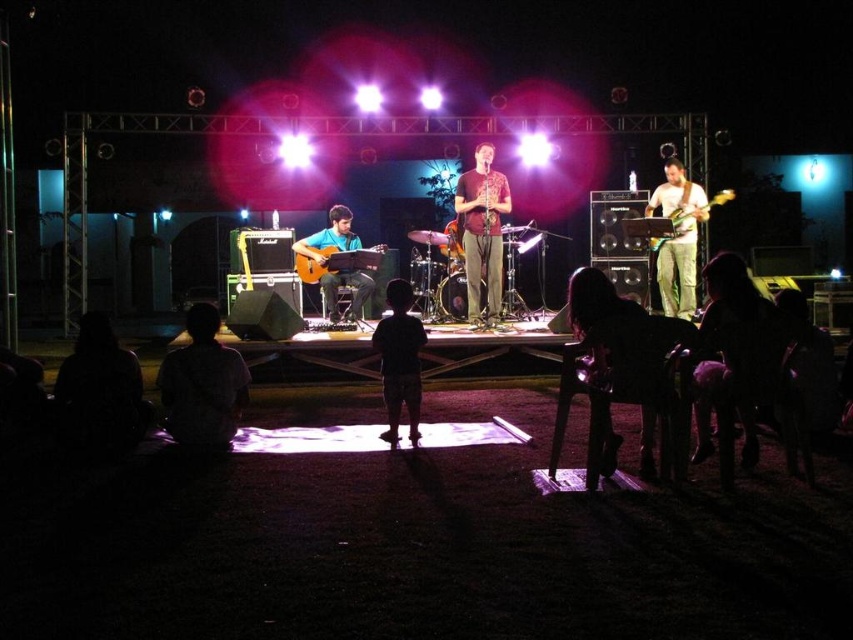
Is point (665, 300) positioned after point (682, 220)?

Yes, point (665, 300) is farther from viewer.

Is point (676, 301) closer to viewer compared to point (663, 240)?

No, (676, 301) is behind (663, 240).

Where is `green camouflage pants at right`? This screenshot has width=853, height=640. green camouflage pants at right is located at coordinates (677, 237).

Does silhouette fabric at lower left appear under dark matte shirt at center?

→ Yes, silhouette fabric at lower left is below dark matte shirt at center.

In the scene shown: Can you confirm if silhouette fabric at lower left is taller than dark matte shirt at center?

No, silhouette fabric at lower left is not taller than dark matte shirt at center.

Is point (235, 362) positioned in front of point (415, 381)?

Yes, it is.

The image size is (853, 640). I want to click on silhouette fabric at lower left, so click(x=202, y=385).

Which is more to the left, green camouflage pants at right or dark matte shirt at center?

dark matte shirt at center

Is green camouflage pants at right below dark matte shirt at center?

No, green camouflage pants at right is not below dark matte shirt at center.

Which is behind, point (691, 278) or point (415, 333)?

The point (691, 278) is behind.

The height and width of the screenshot is (640, 853). I want to click on green camouflage pants at right, so (x=677, y=237).